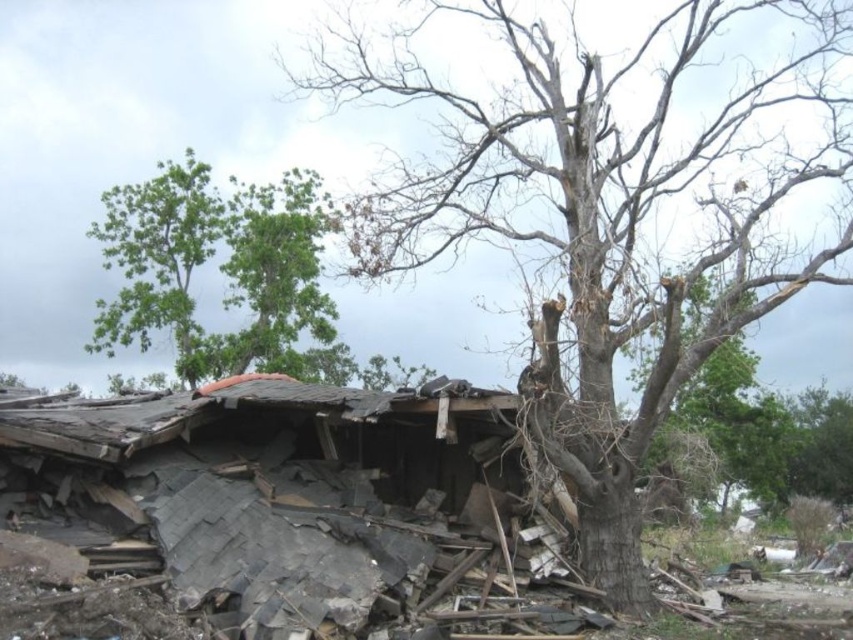
Does bare wood tree at center lie behind green leafy tree at upper left?

That is False.

Between point (503, 26) and point (128, 186), which one is positioned in front?

Point (503, 26) is in front.

Identify the location of bare wood tree at center. (601, 221).